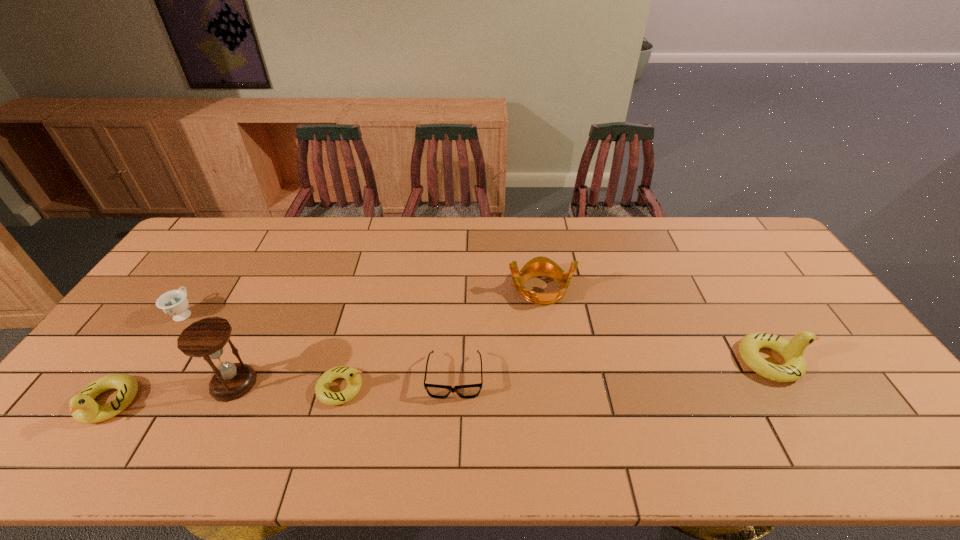
Locate an element on the screen. the leftmost duckling is located at coordinates (83, 407).

Locate an element on the screen. The width and height of the screenshot is (960, 540). the fourth shortest object is located at coordinates (83, 407).

The image size is (960, 540). I want to click on the second duckling from left to right, so click(x=352, y=375).

Find the location of a particular element. The image size is (960, 540). the shortest duckling is located at coordinates (352, 375).

The image size is (960, 540). Find the location of `the rightmost duckling`. the rightmost duckling is located at coordinates (794, 368).

Find the location of a particular element. The height and width of the screenshot is (540, 960). the sixth object from left to right is located at coordinates (539, 266).

The height and width of the screenshot is (540, 960). What are the coordinates of `teacup` in the screenshot? It's located at (174, 303).

Locate an element on the screen. This screenshot has width=960, height=540. the third object from left to right is located at coordinates (206, 338).

At what (x,y) coordinates should I click in order to perform the action: click on hourglass. Please return your answer as a coordinate pair (x, y). Looking at the image, I should click on (206, 338).

Where is `sunglasses`? sunglasses is located at coordinates (473, 390).